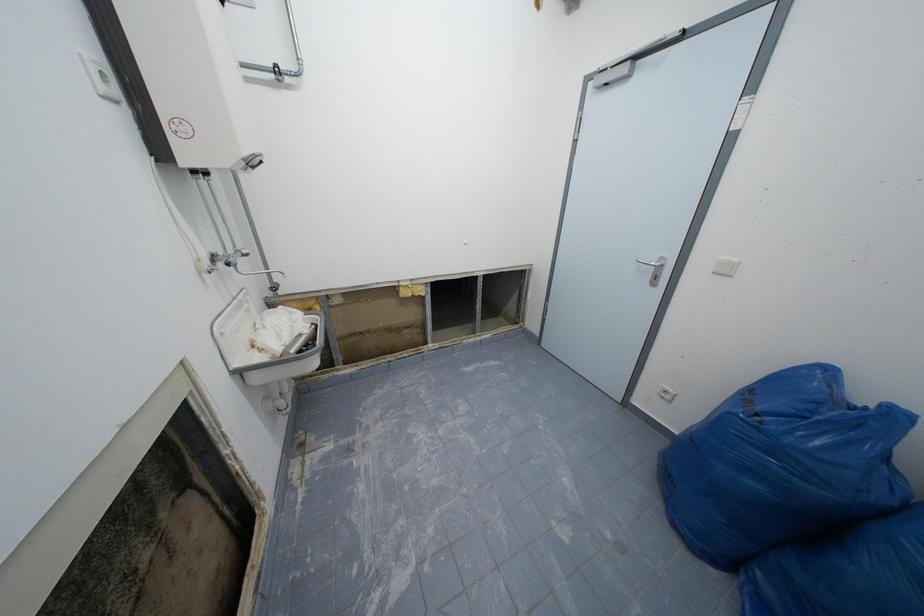
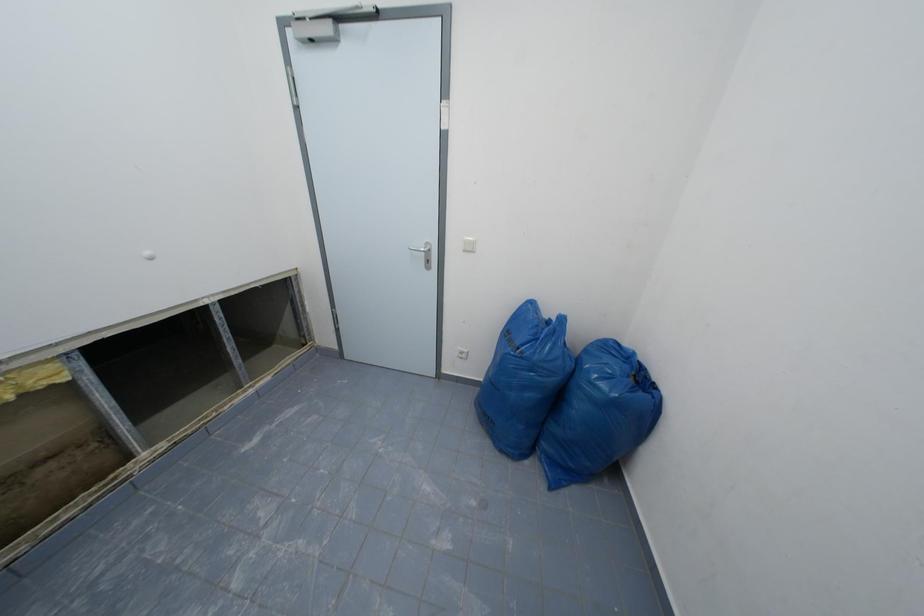
Question: The images are taken continuously from a first-person perspective. In which direction is your viewpoint rotating?

Choices:
 (A) Left
 (B) Right
 (C) Up
 (D) Down

Answer: (B)